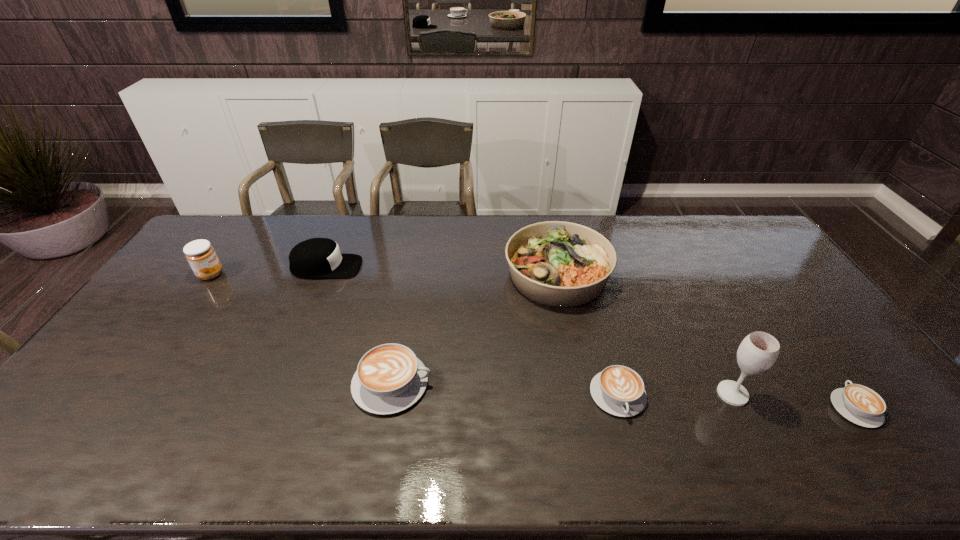
Considering the uniform spacing of cappuccinos, where should an additional cappuccino be positioned on the left? Please locate a free spot. Please provide its 2D coordinates. Your answer should be formatted as a tuple, i.e. [(x, y)], where the tuple contains the x and y coordinates of a point satisfying the conditions above.

[(177, 372)]